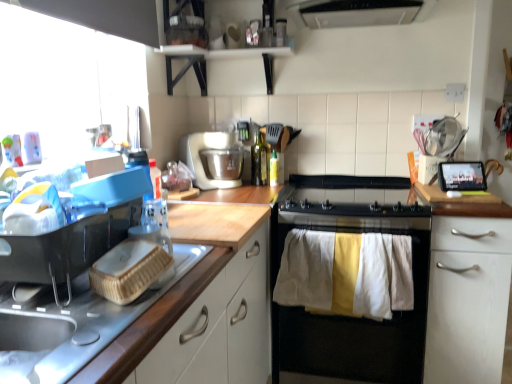
Question: In terms of width, does black glass gas stove at center look wider or thinner when compared to green glass bottle at center, which is counted as the 1th bottle, starting from the left?

Choices:
 (A) wide
 (B) thin

Answer: (A)

Question: From a real-world perspective, is black glass gas stove at center positioned above or below green glass bottle at center, which is counted as the 1th bottle, starting from the left?

Choices:
 (A) below
 (B) above

Answer: (A)

Question: Based on their relative distances, which object is farther from the white plastic mixer at center?

Choices:
 (A) green glass bottle at center, the 1th bottle in the right-to-left sequence
 (B) black glass gas stove at center
 (C) black matte stove at center
 (D) wooden countertop at left, which is the first cabinetry from left to right
 (E) white matte cabinet at right, which is the 2th cabinetry in left-to-right order

Answer: (E)

Question: Based on their relative distances, which object is nearer to the wooden countertop at left, the second cabinetry from the right?

Choices:
 (A) green glass bottle at center, placed as the 2th bottle when sorted from left to right
 (B) green glass bottle at center, which is counted as the 1th bottle, starting from the left
 (C) black matte stove at center
 (D) white plastic mixer at center
 (E) white matte cabinet at right, the 1th cabinetry positioned from the back

Answer: (C)